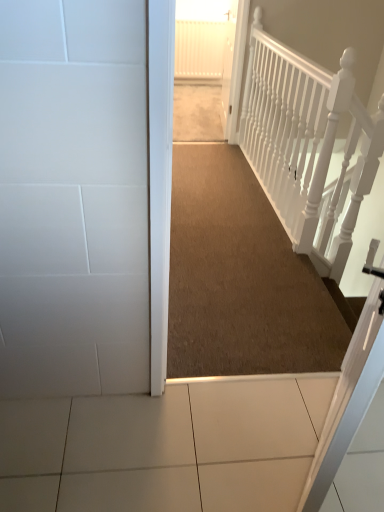
Question: Does carpeted hallway at center have a greater height compared to brown carpet at center?

Choices:
 (A) no
 (B) yes

Answer: (B)

Question: From the image's perspective, is carpeted hallway at center below brown carpet at center?

Choices:
 (A) no
 (B) yes

Answer: (A)

Question: Could you tell me if carpeted hallway at center is facing brown carpet at center?

Choices:
 (A) no
 (B) yes

Answer: (B)

Question: Does carpeted hallway at center lie behind brown carpet at center?

Choices:
 (A) no
 (B) yes

Answer: (B)

Question: Is carpeted hallway at center smaller than brown carpet at center?

Choices:
 (A) no
 (B) yes

Answer: (A)

Question: Can you confirm if carpeted hallway at center is positioned to the left of brown carpet at center?

Choices:
 (A) no
 (B) yes

Answer: (B)

Question: Considering the relative sizes of brown carpet at center and white textured rail at upper right in the image provided, is brown carpet at center bigger than white textured rail at upper right?

Choices:
 (A) no
 (B) yes

Answer: (A)

Question: Considering the relative sizes of brown carpet at center and white textured rail at upper right in the image provided, is brown carpet at center wider than white textured rail at upper right?

Choices:
 (A) no
 (B) yes

Answer: (B)

Question: From the image's perspective, is brown carpet at center located above white textured rail at upper right?

Choices:
 (A) yes
 (B) no

Answer: (A)

Question: From a real-world perspective, is brown carpet at center located higher than white textured rail at upper right?

Choices:
 (A) yes
 (B) no

Answer: (B)

Question: Is brown carpet at center looking in the opposite direction of white textured rail at upper right?

Choices:
 (A) no
 (B) yes

Answer: (A)

Question: Considering the relative sizes of brown carpet at center and white textured rail at upper right in the image provided, is brown carpet at center taller than white textured rail at upper right?

Choices:
 (A) yes
 (B) no

Answer: (B)

Question: Is carpeted hallway at center to the right of white textured rail at upper right from the viewer's perspective?

Choices:
 (A) yes
 (B) no

Answer: (B)